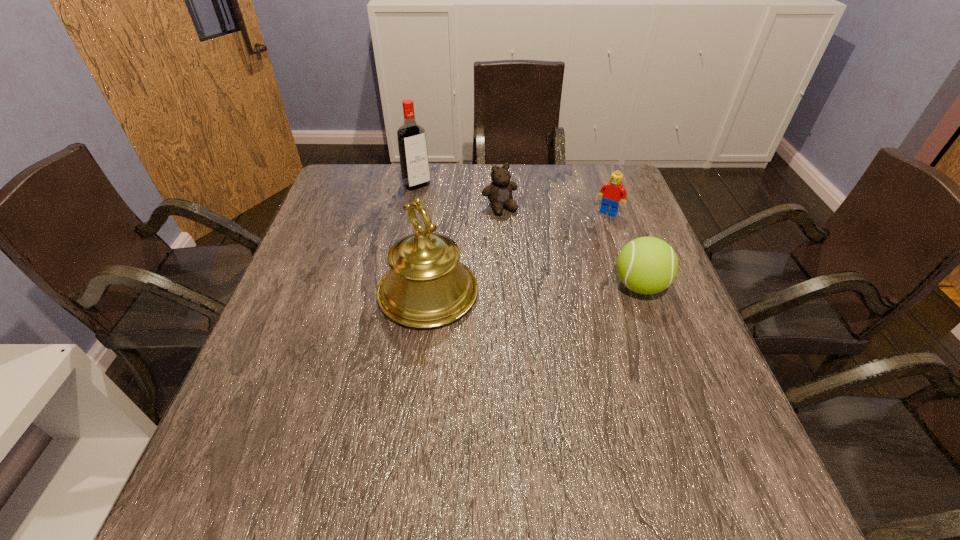
Identify the location of free space on the desktop that is between the bell and the tennis ball and is positioned on the face of the Lego. The image size is (960, 540). (560, 288).

Image resolution: width=960 pixels, height=540 pixels. In order to click on vacant space on the desktop that is between the bell and the tennis ball and is positioned on the front and back of the vodka in this screenshot , I will do `click(514, 290)`.

Locate an element on the screen. This screenshot has height=540, width=960. vacant spot on the desktop that is between the bell and the tennis ball and is positioned on the face of the third object from left to right is located at coordinates (560, 289).